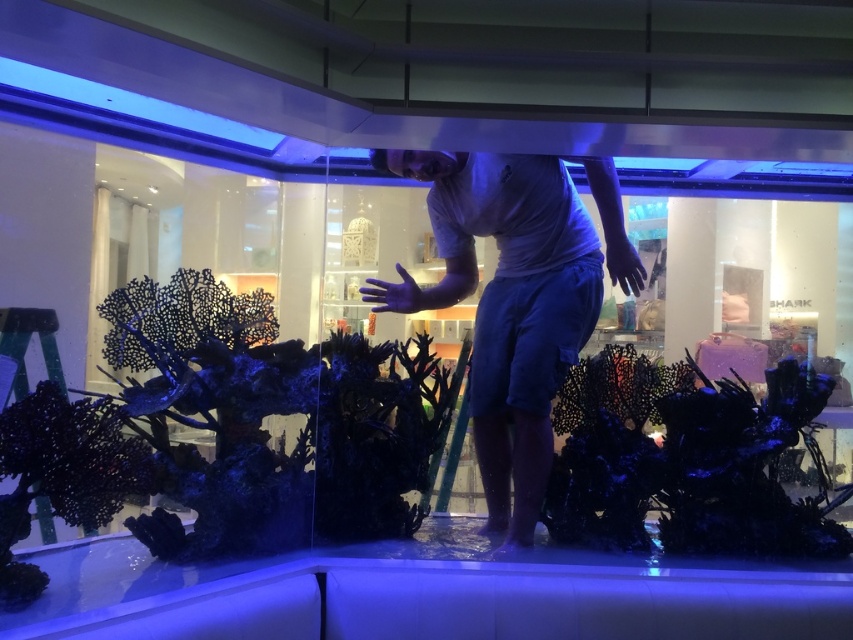
Question: Can you confirm if white matte shirt at center is smaller than black matte coral at center?

Choices:
 (A) yes
 (B) no

Answer: (B)

Question: Among these objects, which one is farthest from the camera?

Choices:
 (A) white matte shirt at center
 (B) black matte coral at center

Answer: (A)

Question: Is white matte shirt at center bigger than black matte coral at center?

Choices:
 (A) yes
 (B) no

Answer: (A)

Question: Can you confirm if white matte shirt at center is bigger than black matte coral at center?

Choices:
 (A) yes
 (B) no

Answer: (A)